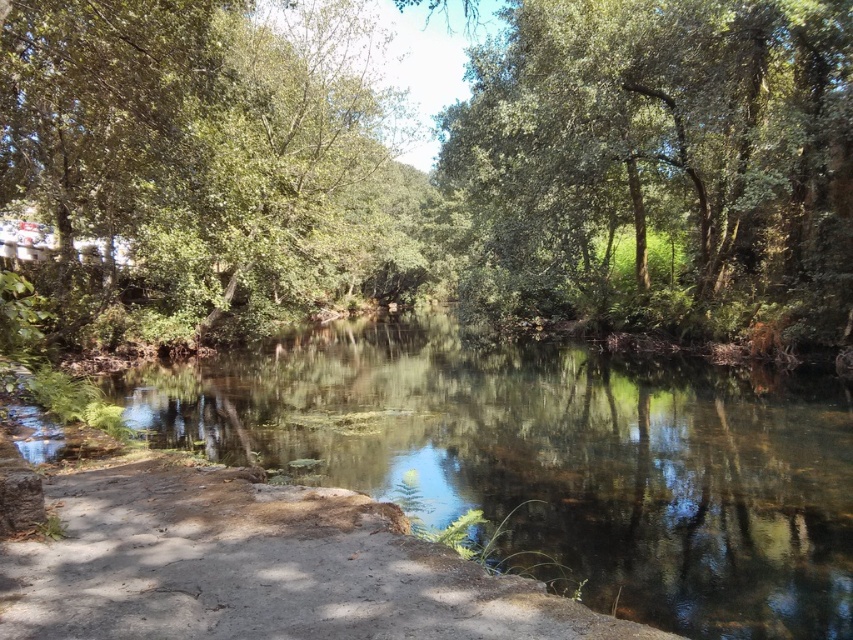
Can you confirm if green leafy tree at center is bigger than dull gray concrete at lower left?

Correct, green leafy tree at center is larger in size than dull gray concrete at lower left.

How distant is green leafy tree at center from dull gray concrete at lower left?

27.38 meters

Which is behind, point (595, 52) or point (267, 627)?

The point (595, 52) is behind.

Where is `green leafy tree at center`? The height and width of the screenshot is (640, 853). green leafy tree at center is located at coordinates [x=434, y=164].

Is green leafy tree at center thinner than green leafy tree at upper center?

No.

Locate an element on the screen. green leafy tree at center is located at coordinates (434, 164).

Is point (772, 225) positioned after point (364, 576)?

Yes, it is behind point (364, 576).

Can you confirm if green leafy tree at upper center is taller than dull gray concrete at lower left?

Yes, green leafy tree at upper center is taller than dull gray concrete at lower left.

Find the location of a particular element. green leafy tree at upper center is located at coordinates (662, 157).

Find the location of a particular element. Image resolution: width=853 pixels, height=640 pixels. green leafy tree at upper center is located at coordinates (662, 157).